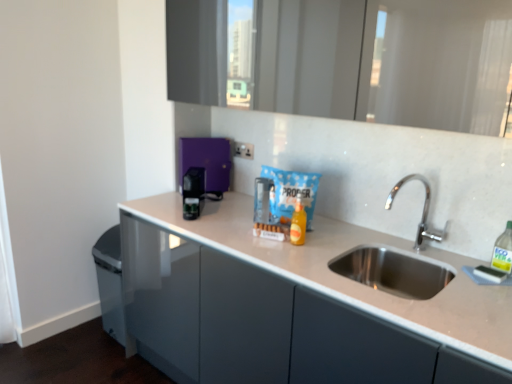
In order to click on free location in front of translucent orange bottle at center, which is counted as the first bottle, starting from the left in this screenshot , I will do `click(287, 258)`.